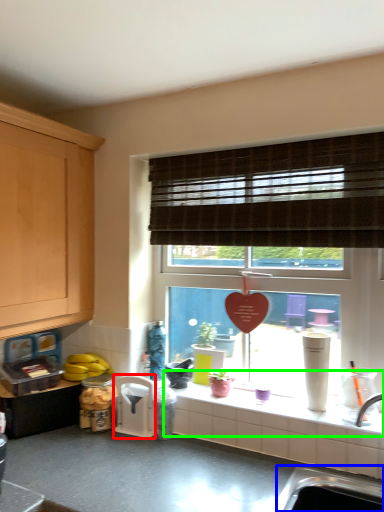
Question: Which object is positioned farthest from appliance (highlighted by a red box)? Select from sink (highlighted by a blue box) and window sill (highlighted by a green box).

Choices:
 (A) sink
 (B) window sill

Answer: (A)